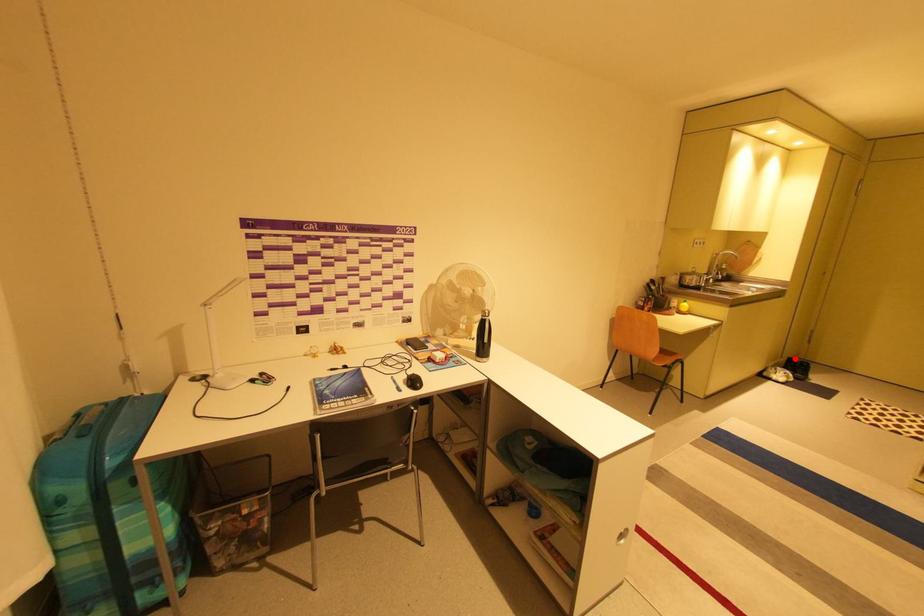
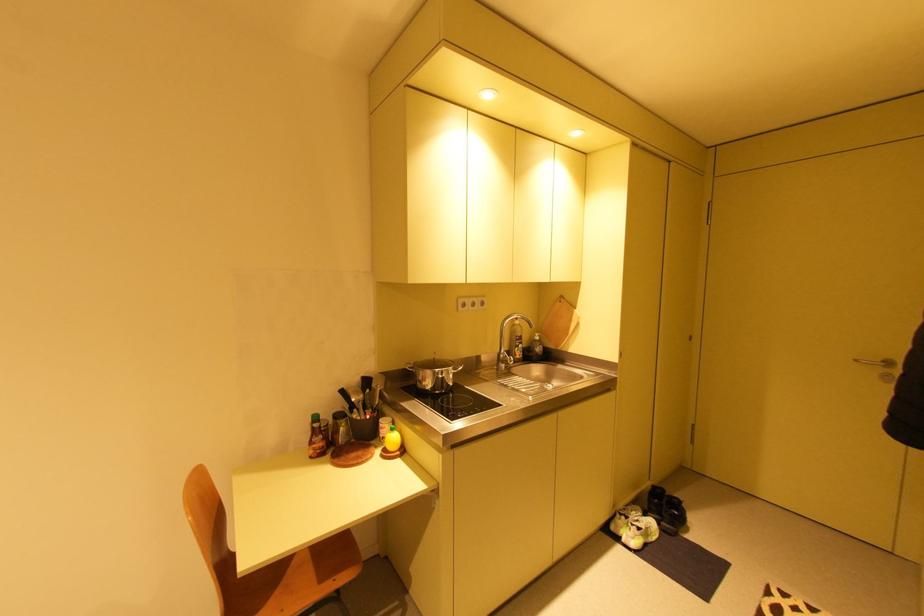
Question: I am providing you with two images of the same scene from different viewpoints. A red point is shown in image1. For the corresponding object point in image2, is it positioned nearer or farther from the camera?

Choices:
 (A) Nearer
 (B) Farther

Answer: (A)